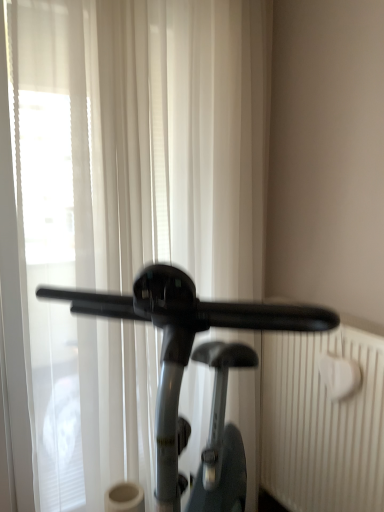
Question: Does black glossy stationary bicycle at center have a larger size compared to white sheer curtain at center?

Choices:
 (A) no
 (B) yes

Answer: (B)

Question: From the image's perspective, does black glossy stationary bicycle at center appear higher than white sheer curtain at center?

Choices:
 (A) yes
 (B) no

Answer: (B)

Question: From a real-world perspective, is black glossy stationary bicycle at center positioned under white sheer curtain at center based on gravity?

Choices:
 (A) no
 (B) yes

Answer: (B)

Question: From a real-world perspective, does black glossy stationary bicycle at center stand above white sheer curtain at center?

Choices:
 (A) no
 (B) yes

Answer: (A)

Question: Is black glossy stationary bicycle at center thinner than white sheer curtain at center?

Choices:
 (A) no
 (B) yes

Answer: (A)

Question: Is black glossy stationary bicycle at center far from white sheer curtain at center?

Choices:
 (A) no
 (B) yes

Answer: (A)

Question: From the image's perspective, is black glossy stationary bicycle at center located beneath white textured radiator at right?

Choices:
 (A) no
 (B) yes

Answer: (A)

Question: Does black glossy stationary bicycle at center appear on the right side of white textured radiator at right?

Choices:
 (A) yes
 (B) no

Answer: (B)

Question: Is white textured radiator at right a part of black glossy stationary bicycle at center?

Choices:
 (A) no
 (B) yes

Answer: (A)

Question: From a real-world perspective, is black glossy stationary bicycle at center on white textured radiator at right?

Choices:
 (A) yes
 (B) no

Answer: (A)

Question: Considering the relative sizes of black glossy stationary bicycle at center and white textured radiator at right in the image provided, is black glossy stationary bicycle at center bigger than white textured radiator at right?

Choices:
 (A) yes
 (B) no

Answer: (A)

Question: Does black glossy stationary bicycle at center have a greater height compared to white textured radiator at right?

Choices:
 (A) yes
 (B) no

Answer: (A)

Question: Is the depth of white sheer curtain at center greater than that of white textured radiator at right?

Choices:
 (A) no
 (B) yes

Answer: (A)